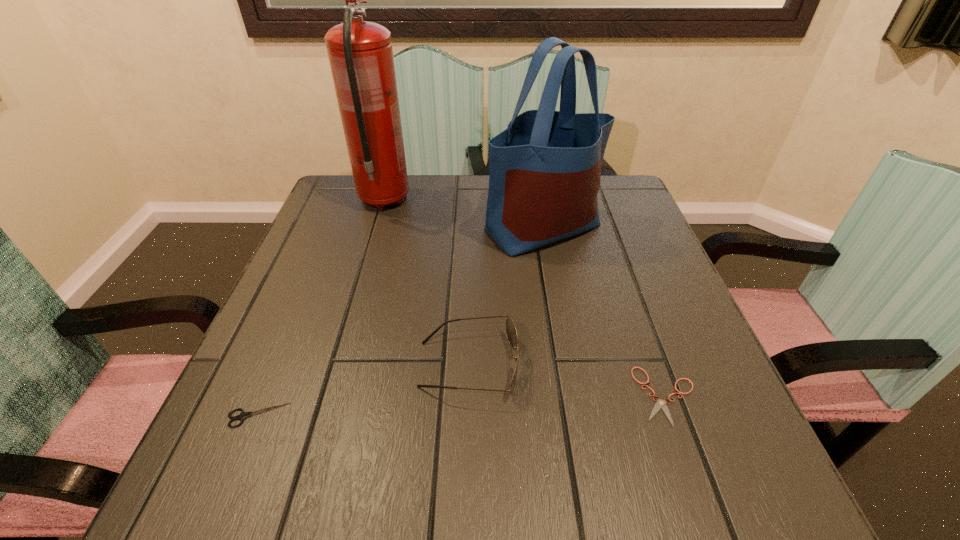
Locate an element on the screen. fire extinguisher is located at coordinates (360, 53).

Where is `the fourth shortest object`? The height and width of the screenshot is (540, 960). the fourth shortest object is located at coordinates (544, 170).

What are the coordinates of `sunglasses` in the screenshot? It's located at click(x=511, y=332).

Identify the location of the left shears. (242, 416).

At what (x,y) coordinates should I click in order to perform the action: click on the fourth tallest object. Please return your answer as a coordinate pair (x, y). Image resolution: width=960 pixels, height=540 pixels. Looking at the image, I should click on (242, 416).

Find the location of a particular element. This screenshot has height=540, width=960. the shorter shears is located at coordinates (660, 403).

Where is `the shortest object`? This screenshot has width=960, height=540. the shortest object is located at coordinates click(x=660, y=403).

Where is `vacant space located on the front of the handbag`? vacant space located on the front of the handbag is located at coordinates (554, 293).

Find the location of a particular element. The image size is (960, 540). vacant space situated on the front-facing side of the third tallest object is located at coordinates [x=582, y=364].

Find the location of `free space located on the right of the taller shears`. free space located on the right of the taller shears is located at coordinates (462, 415).